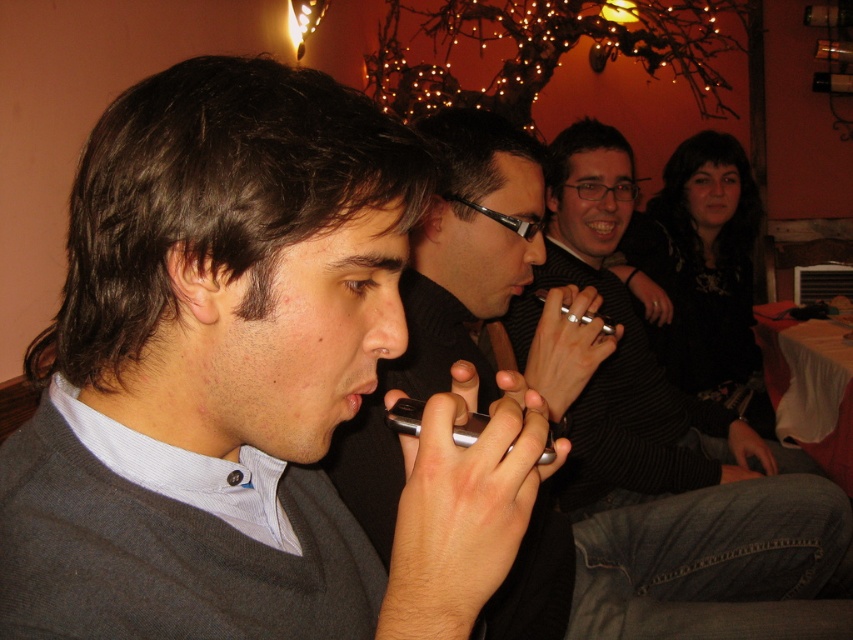
You are a photographer trying to capture a candid shot of the black textured sweater at center and the pink matte lips at center. Based on their positions, which one should you focus on first if you want to ensure both are in the frame without moving the camera?

The black textured sweater at center is taller than the pink matte lips at center, so you should focus on the black textured sweater at center first to ensure both are in the frame without moving the camera.